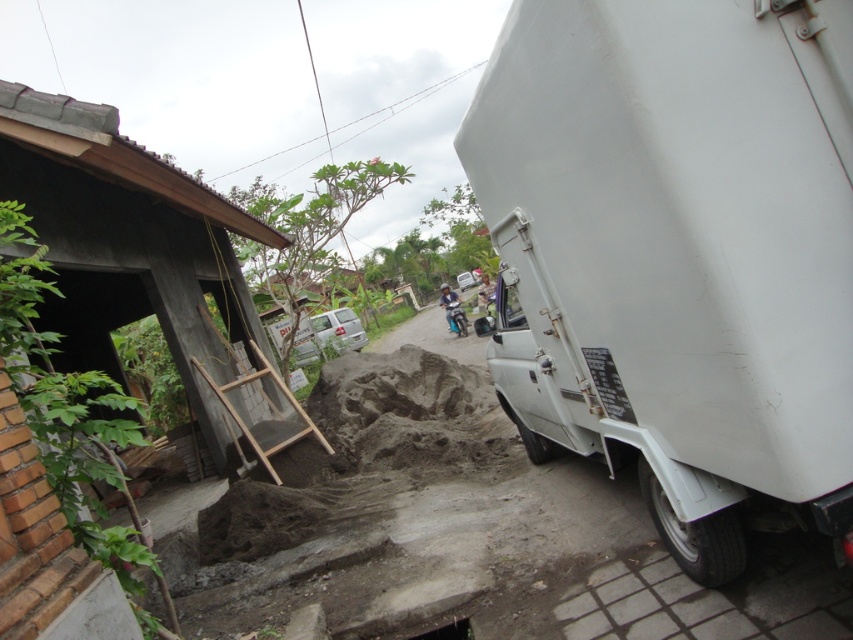
Question: Where is smooth concrete hut at left located in relation to wooden ladder at lower left in the image?

Choices:
 (A) right
 (B) left

Answer: (B)

Question: Estimate the real-world distances between objects in this image. Which object is closer to the white matte truck at right?

Choices:
 (A) smooth concrete hut at left
 (B) wooden ladder at lower left

Answer: (B)

Question: Is smooth concrete hut at left bigger than wooden ladder at lower left?

Choices:
 (A) no
 (B) yes

Answer: (A)

Question: Is white matte truck at right wider than wooden ladder at lower left?

Choices:
 (A) yes
 (B) no

Answer: (B)

Question: Which of the following is the closest to the observer?

Choices:
 (A) (270, 470)
 (B) (788, 65)

Answer: (B)

Question: Which object appears closest to the camera in this image?

Choices:
 (A) white matte truck at right
 (B) smooth concrete hut at left
 (C) wooden ladder at lower left

Answer: (A)